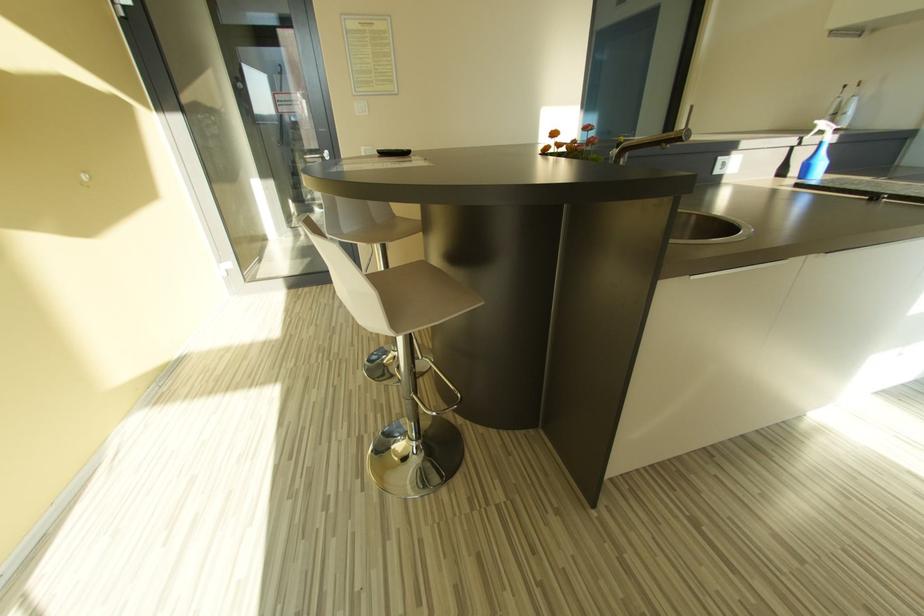
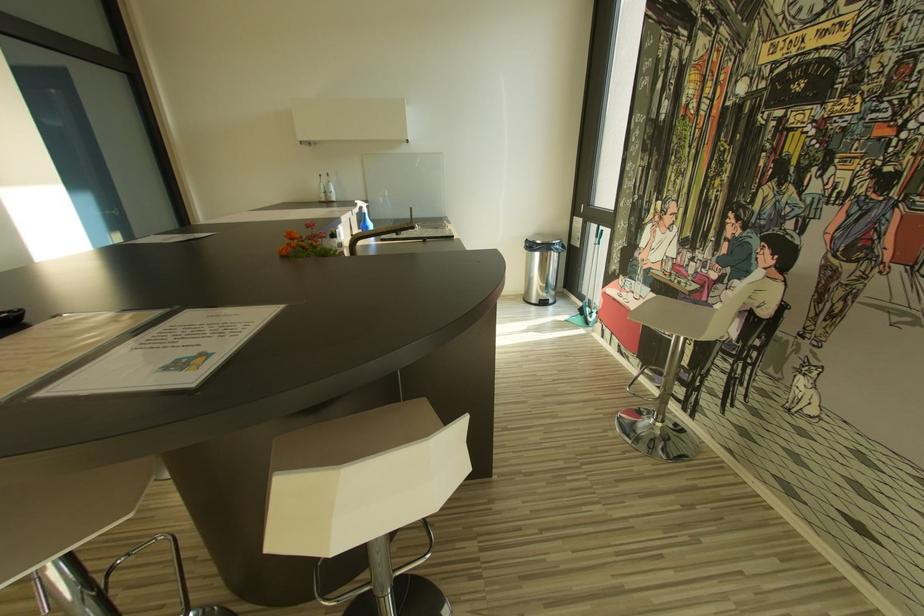
Question: How did the camera likely rotate?

Choices:
 (A) Left
 (B) Right
 (C) Up
 (D) Down

Answer: (B)